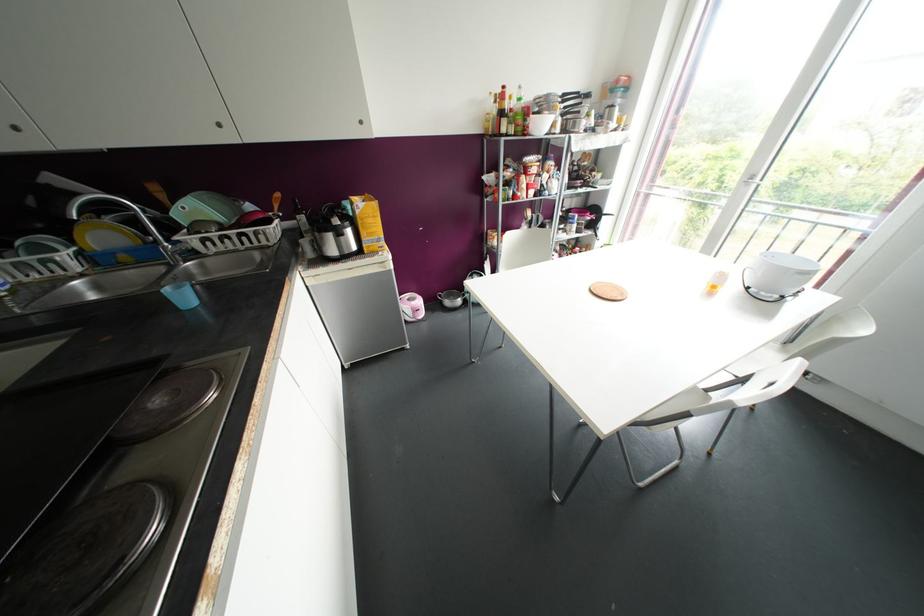
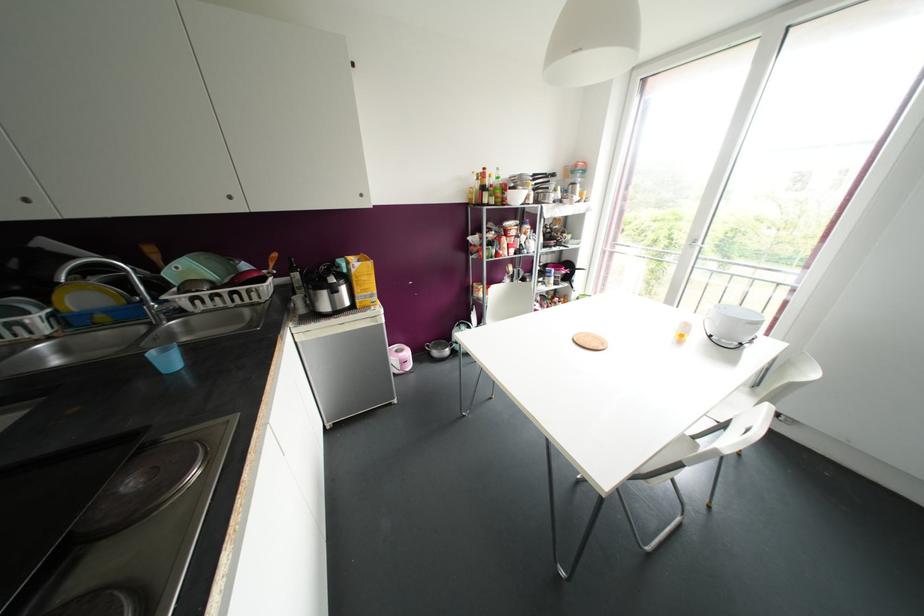
In the scene shown: The images are taken continuously from a first-person perspective. In which direction are you moving?

The movement direction of the cameraman is left, backward.